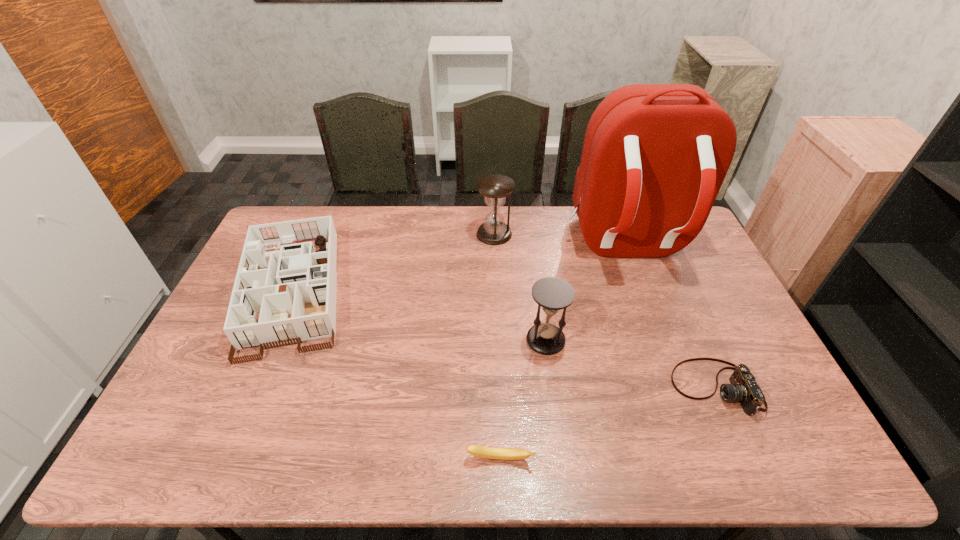
Where is `backpack located at the right edge`? The image size is (960, 540). backpack located at the right edge is located at coordinates (654, 158).

Locate an element on the screen. The image size is (960, 540). camera that is at the right edge is located at coordinates tap(743, 388).

You are a GUI agent. You are given a task and a screenshot of the screen. Output one action in this format:
    pyautogui.click(x=<x>, y=<y>)
    Task: Click on the object present at the far left corner
    
    Given the screenshot: What is the action you would take?
    pyautogui.click(x=294, y=289)

Find the location of a particular element. The image size is (960, 540). object that is at the far right corner is located at coordinates pyautogui.click(x=654, y=158).

The height and width of the screenshot is (540, 960). In order to click on vacant space at the far edge in this screenshot , I will do pyautogui.click(x=535, y=220).

You are a GUI agent. You are given a task and a screenshot of the screen. Output one action in this format:
    pyautogui.click(x=<x>, y=<y>)
    Task: Click on the vacant region at the near edge of the desktop
    
    Given the screenshot: What is the action you would take?
    pyautogui.click(x=555, y=437)

Locate an element on the screen. vacant space at the left edge is located at coordinates (221, 367).

Locate an element on the screen. free space at the right edge of the desktop is located at coordinates (689, 307).

Find the location of a particular element. empty location between the farther hourglass and the third shortest object is located at coordinates (394, 262).

The width and height of the screenshot is (960, 540). What are the coordinates of `free spot between the tallest object and the banana` in the screenshot? It's located at (563, 352).